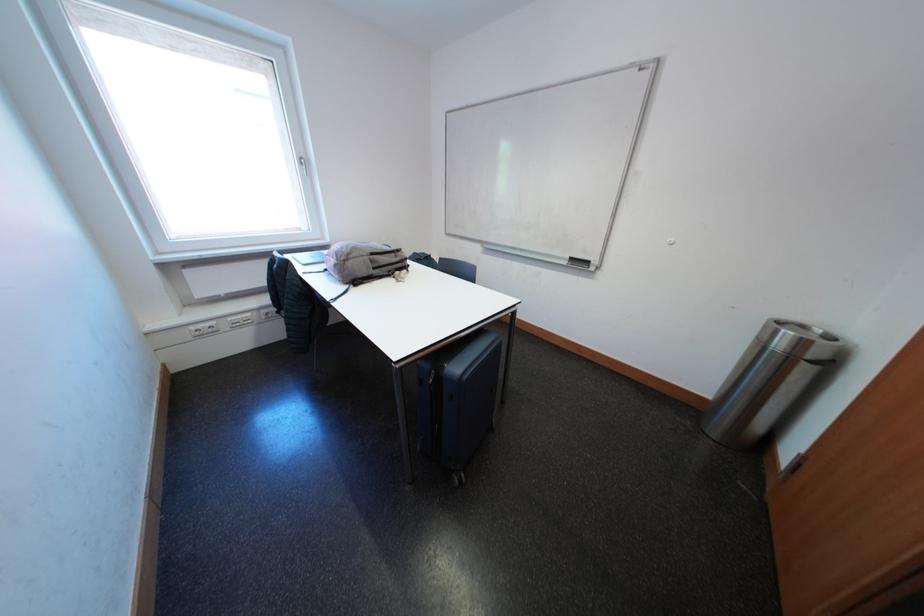
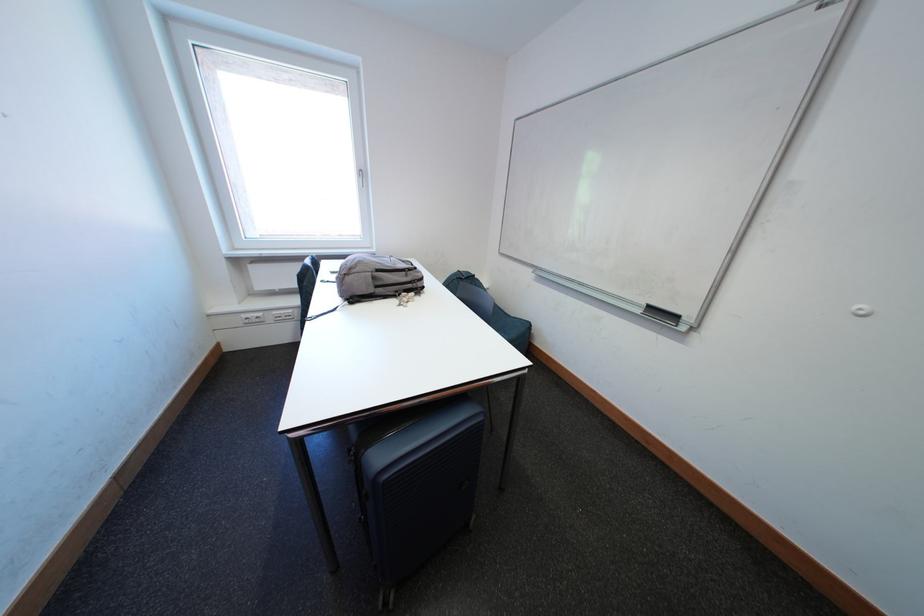
Question: The camera is either moving clockwise (left) or counter-clockwise (right) around the object. The first image is from the beginning of the video and the second image is from the end. Is the camera moving left or right when shooting the video?

Choices:
 (A) Left
 (B) Right

Answer: (B)